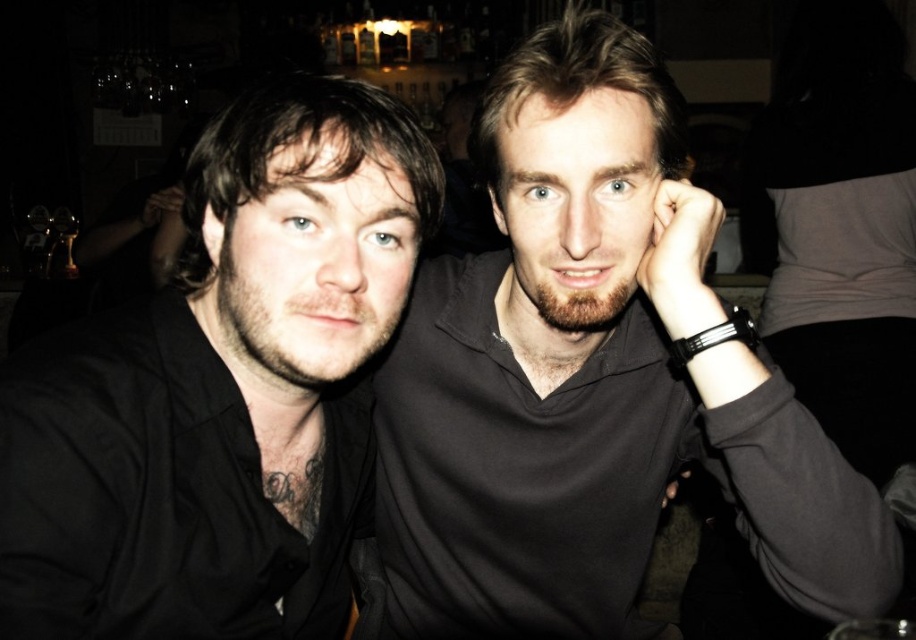
Question: Is matte black shirt at center bigger than matte black shirt at left?

Choices:
 (A) no
 (B) yes

Answer: (B)

Question: Which object appears farthest from the camera in this image?

Choices:
 (A) matte black shirt at center
 (B) matte black shirt at left

Answer: (A)

Question: Which object appears farthest from the camera in this image?

Choices:
 (A) matte black shirt at left
 (B) matte black shirt at center

Answer: (B)

Question: Considering the relative positions of matte black shirt at center and matte black shirt at left in the image provided, where is matte black shirt at center located with respect to matte black shirt at left?

Choices:
 (A) left
 (B) right

Answer: (B)

Question: Is matte black shirt at center below matte black shirt at left?

Choices:
 (A) no
 (B) yes

Answer: (B)

Question: Among these points, which one is nearest to the camera?

Choices:
 (A) (345, 378)
 (B) (496, 76)

Answer: (B)